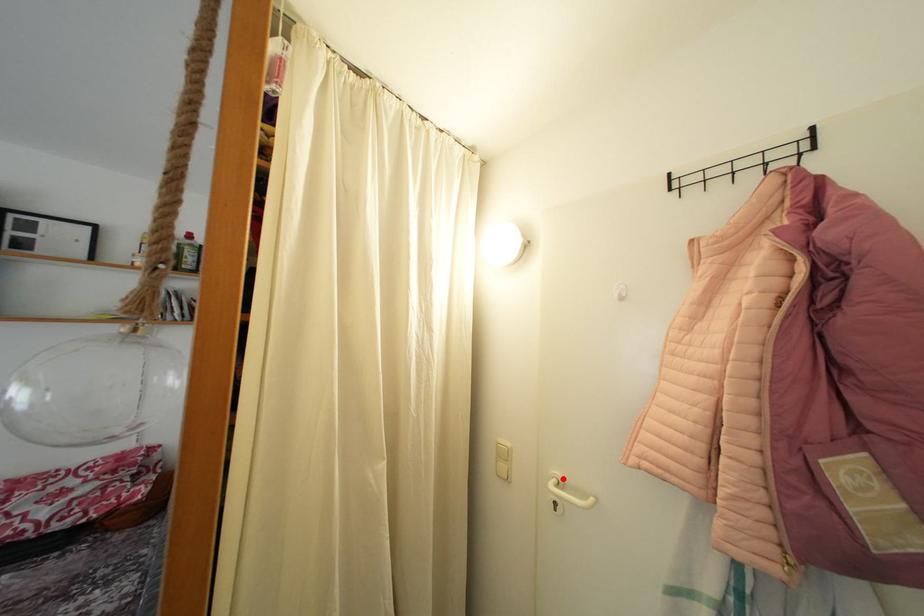
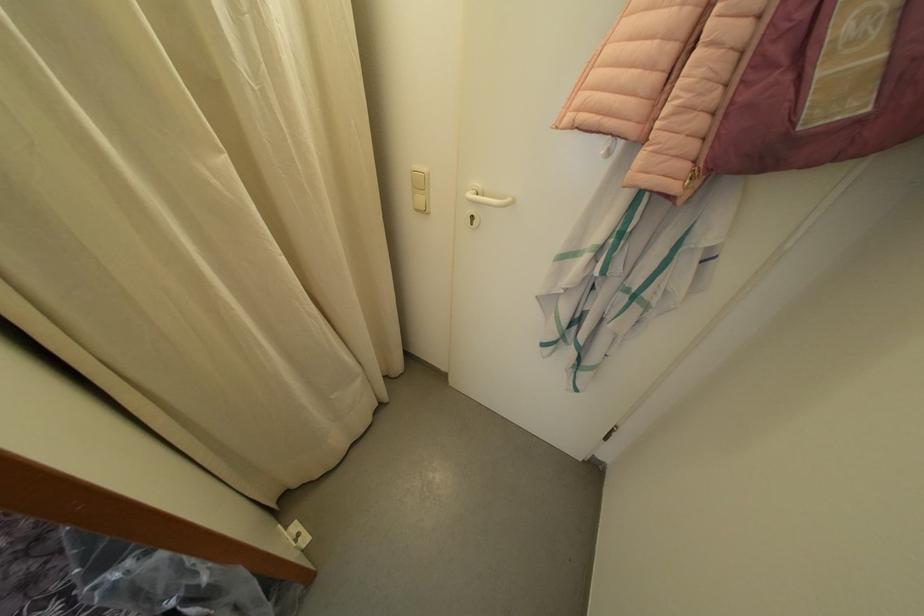
Locate, in the second image, the point that corresponds to the highlighted location in the first image.

(482, 190)